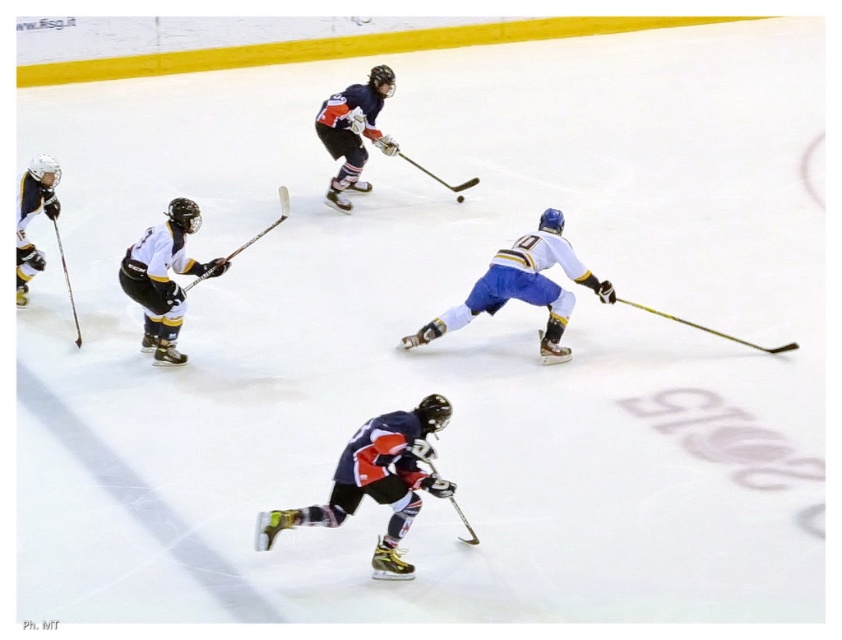
You are an ice hockey player trying to grab a stick quickly. You see the yellow matte hockey stick at lower right and the shiny black hockey stick at left. Which stick is closer to you?

The yellow matte hockey stick at lower right is closer to you because it is further to the viewer than the shiny black hockey stick at left.